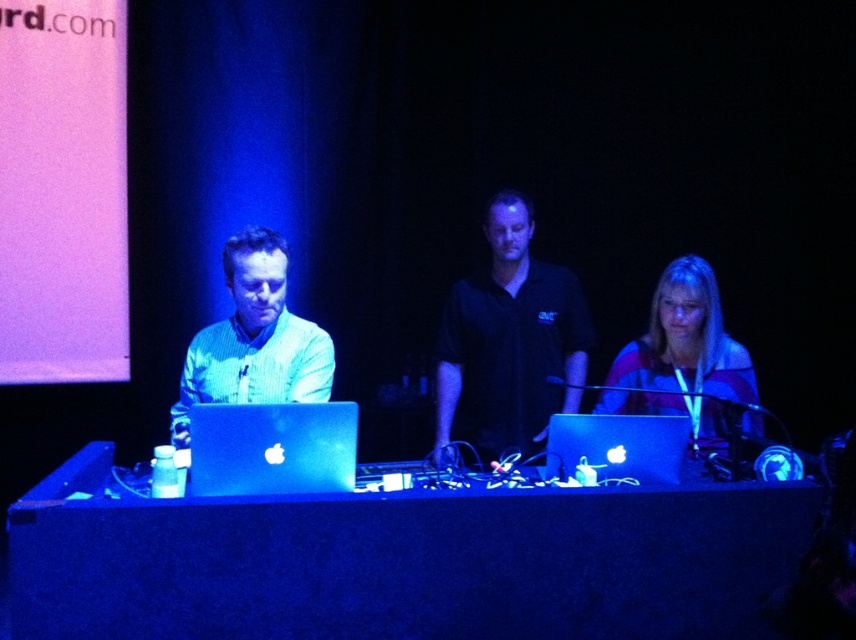
Question: Which object is farther from the camera taking this photo?

Choices:
 (A) striped fabric shirt at center
 (B) green matte shirt at center

Answer: (A)

Question: In this image, where is black matte table at center located relative to striped fabric shirt at center?

Choices:
 (A) below
 (B) above

Answer: (A)

Question: Which object appears farthest from the camera in this image?

Choices:
 (A) sleek silver laptop at center
 (B) glossy aluminum laptop at center

Answer: (A)

Question: Can you confirm if glossy aluminum laptop at center is positioned above sleek silver laptop at center?

Choices:
 (A) yes
 (B) no

Answer: (A)

Question: Which of the following is the farthest from the observer?

Choices:
 (A) glossy aluminum laptop at center
 (B) green matte shirt at center
 (C) sleek silver laptop at center

Answer: (B)

Question: Does black matte shirt at center appear over striped fabric shirt at center?

Choices:
 (A) no
 (B) yes

Answer: (B)